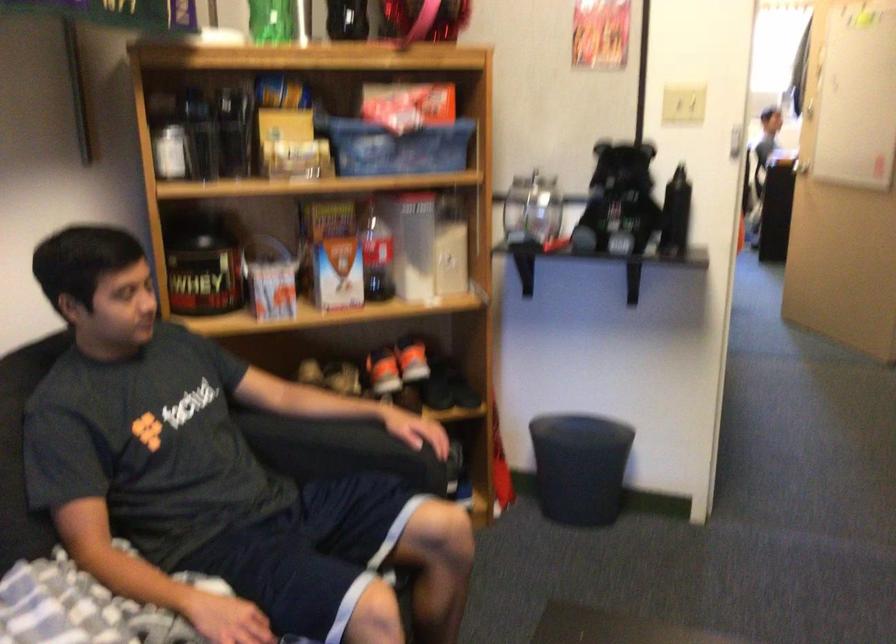
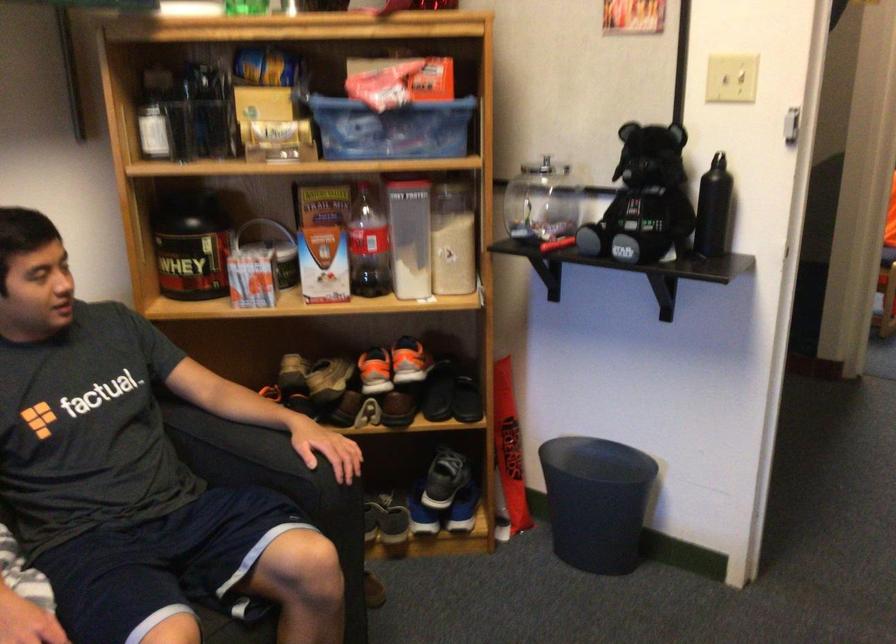
In the second image, find the point that corresponds to the point at 625,200 in the first image.

(643, 200)